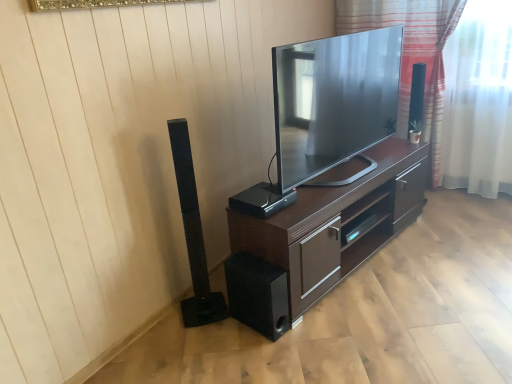
Where is `free space in front of black matte speaker at lower center, the 2th speaker positioned from the right`? free space in front of black matte speaker at lower center, the 2th speaker positioned from the right is located at coordinates (260, 354).